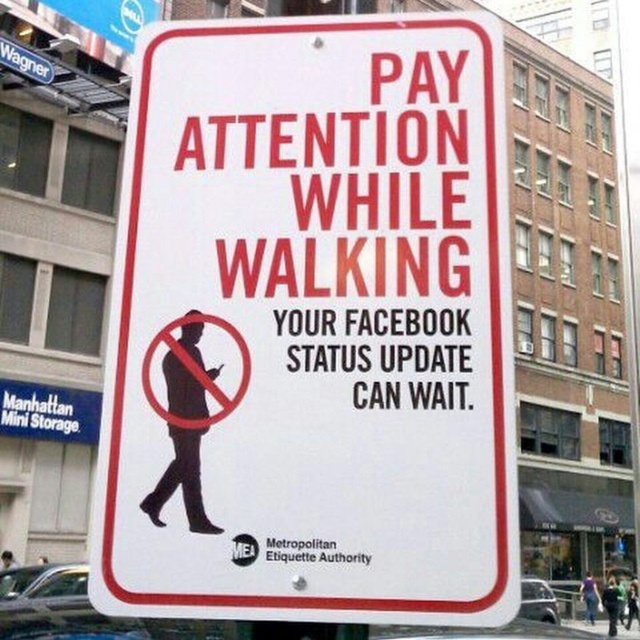
You are a delivery driver who needs to know which sign is narrower. You see a white paper sign at center and a white plastic sign at upper left. Which one is narrower?

The white paper sign at center has a lesser width compared to white plastic sign at upper left, so the white paper sign at center is narrower.

You are a delivery driver planning to navigate through an urban area. You see a white paper sign at center and a white plastic sign at upper left. Which one is taller?

The white paper sign at center is much taller than the white plastic sign at upper left.

You are a pedestrian looking at the road sign and want to know which object is on the left side between the white paper sign at center and the white plastic sign at upper left. Which one is on the left?

The white plastic sign at upper left is on the left side because the white paper sign at center is positioned on its right side.